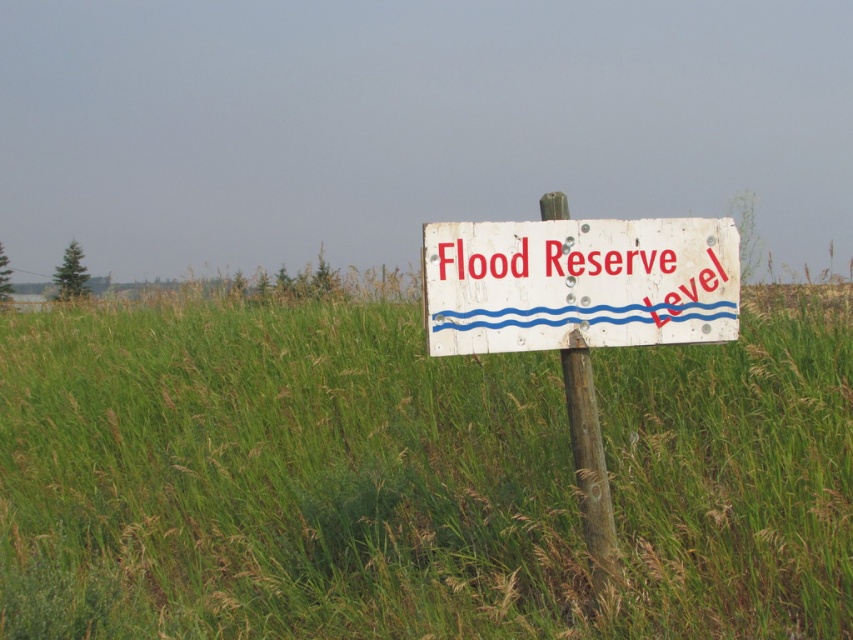
Question: Does green grassy at center appear on the right side of white wooden sign at center?

Choices:
 (A) yes
 (B) no

Answer: (B)

Question: Can you confirm if green grassy at center is smaller than white wooden sign at center?

Choices:
 (A) no
 (B) yes

Answer: (B)

Question: Which of the following is the farthest from the observer?

Choices:
 (A) green grassy at center
 (B) white wooden sign at center

Answer: (A)

Question: Which of the following is the farthest from the observer?

Choices:
 (A) white wooden sign at center
 (B) green grassy at center

Answer: (B)

Question: Does green grassy at center appear under white wooden sign at center?

Choices:
 (A) yes
 (B) no

Answer: (A)

Question: Which point is farther from the camera taking this photo?

Choices:
 (A) (189, 566)
 (B) (437, 262)

Answer: (A)